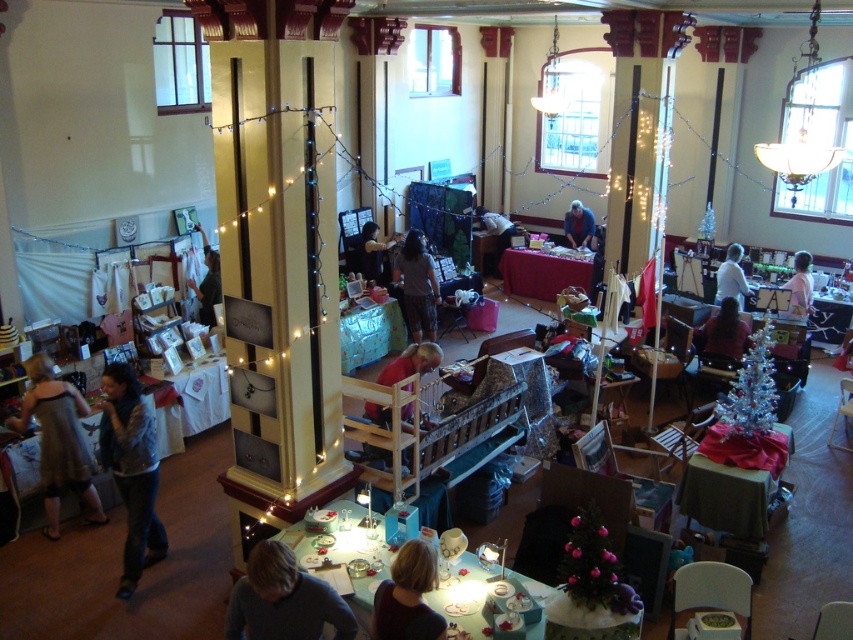
Question: From the image, what is the correct spatial relationship of gray cotton shirt at center in relation to dark gray sweater at center?

Choices:
 (A) right
 (B) left

Answer: (A)

Question: Does shiny teal table at center have a larger size compared to blonde hair at lower center?

Choices:
 (A) no
 (B) yes

Answer: (B)

Question: Which object is positioned farthest from the matte red shirt at center?

Choices:
 (A) wooden table at center
 (B) blonde hair at lower center
 (C) gray cotton shirt at center
 (D) shiny metallic table at lower right

Answer: (C)

Question: Estimate the real-world distances between objects in this image. Which object is farther from the pink fabric at center?

Choices:
 (A) dark gray sweater at center
 (B) matte black shirt at center
 (C) white matte shirt at center
 (D) denim jacket at lower left

Answer: (D)

Question: Is shiny teal table at center closer to the viewer compared to white matte shirt at center?

Choices:
 (A) yes
 (B) no

Answer: (A)

Question: Which object is the closest to the wooden table at center?

Choices:
 (A) shiny metallic table at lower right
 (B) matte brown chair at center

Answer: (B)